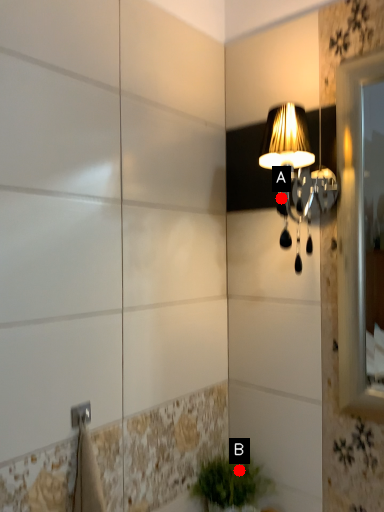
Question: Two points are circled on the image, labeled by A and B beside each circle. Among these points, which one is nearest to the camera?

Choices:
 (A) A is closer
 (B) B is closer

Answer: (A)